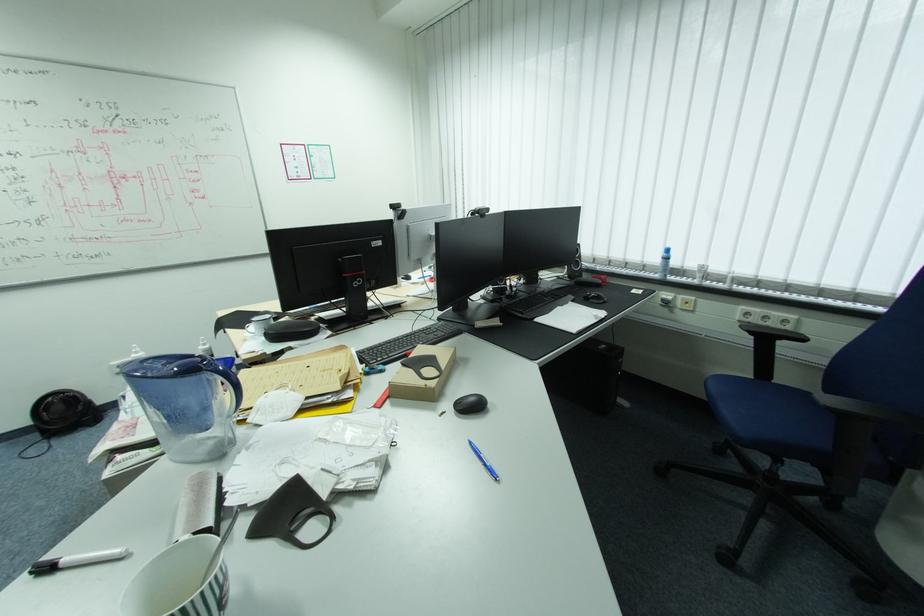
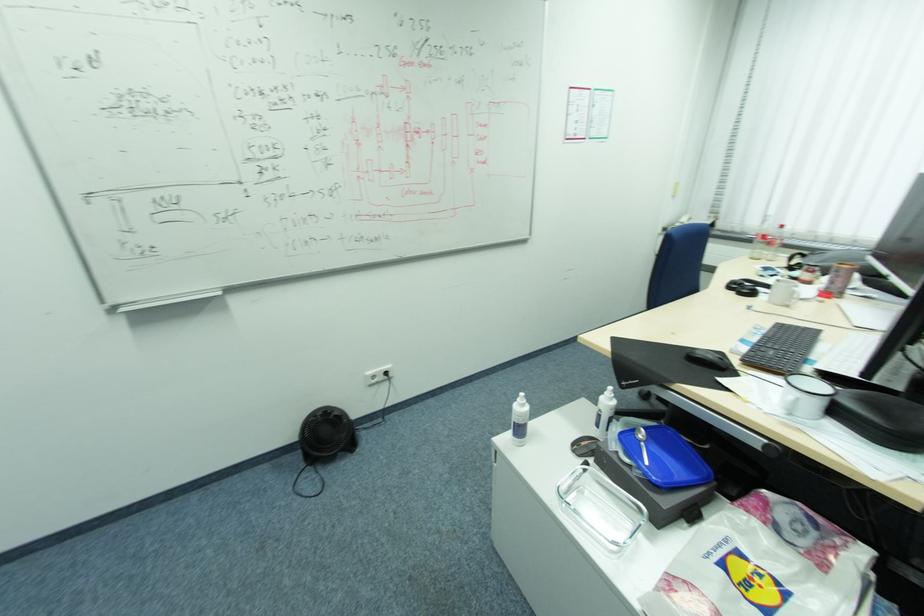
Find the pixel in the second image that matches (x=43, y=435) in the first image.

(304, 456)